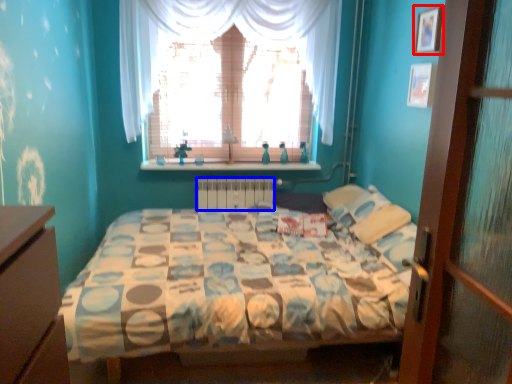
Question: Which point is closer to the camera, picture frame (highlighted by a red box) or radiator (highlighted by a blue box)?

Choices:
 (A) picture frame
 (B) radiator

Answer: (A)